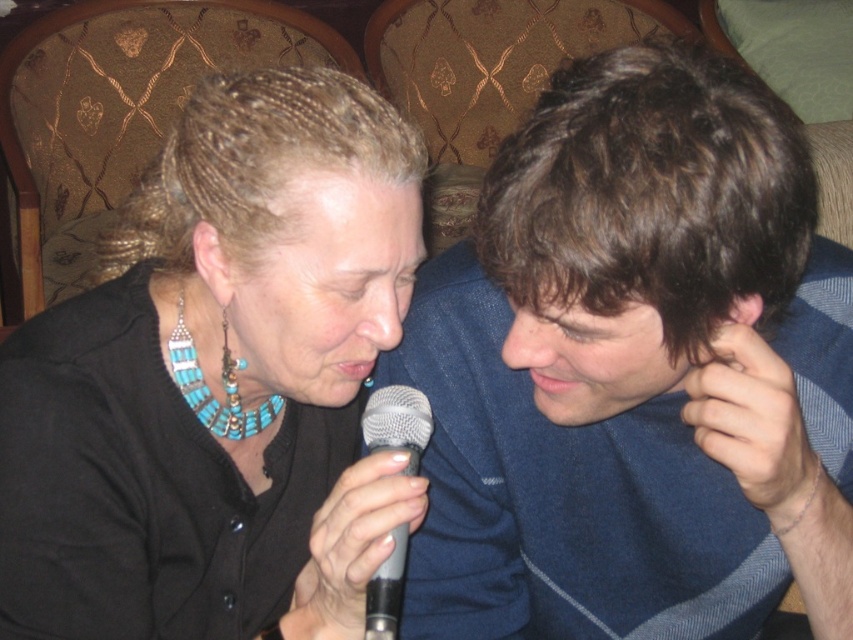
Does blue knit sweater at center come in front of turquoise beaded necklace at center?

Yes, blue knit sweater at center is closer to the viewer.

The width and height of the screenshot is (853, 640). What do you see at coordinates (635, 371) in the screenshot?
I see `blue knit sweater at center` at bounding box center [635, 371].

Image resolution: width=853 pixels, height=640 pixels. I want to click on blue knit sweater at center, so click(x=635, y=371).

Who is more forward, (595, 493) or (398, 625)?

Positioned in front is point (595, 493).

Locate an element on the screen. blue knit sweater at center is located at coordinates (635, 371).

You are a GUI agent. You are given a task and a screenshot of the screen. Output one action in this format:
    pyautogui.click(x=<x>, y=<y>)
    Task: Click on the blue knit sweater at center
    The width and height of the screenshot is (853, 640).
    Given the screenshot: What is the action you would take?
    pyautogui.click(x=635, y=371)

Consider the image. Does turquoise beaded necklace at center appear on the left side of silver metallic microphone at center?

Yes, turquoise beaded necklace at center is to the left of silver metallic microphone at center.

Which of these two, turquoise beaded necklace at center or silver metallic microphone at center, stands shorter?

silver metallic microphone at center

This screenshot has height=640, width=853. I want to click on turquoise beaded necklace at center, so click(x=219, y=381).